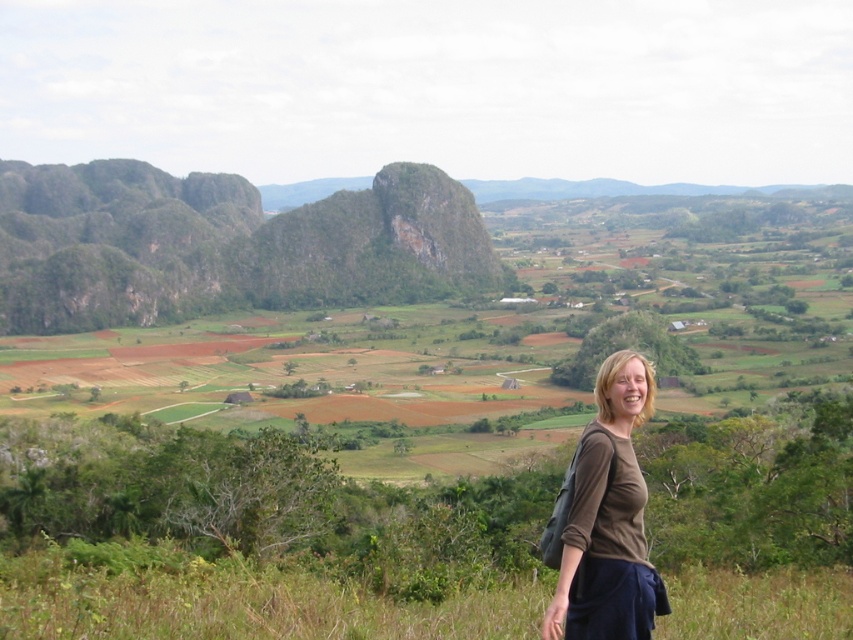
Can you confirm if green rock formation at upper left is smaller than brown cotton shirt at lower right?

Incorrect, green rock formation at upper left is not smaller in size than brown cotton shirt at lower right.

Find the location of a particular element. green rock formation at upper left is located at coordinates (224, 244).

This screenshot has width=853, height=640. Identify the location of green rock formation at upper left. (224, 244).